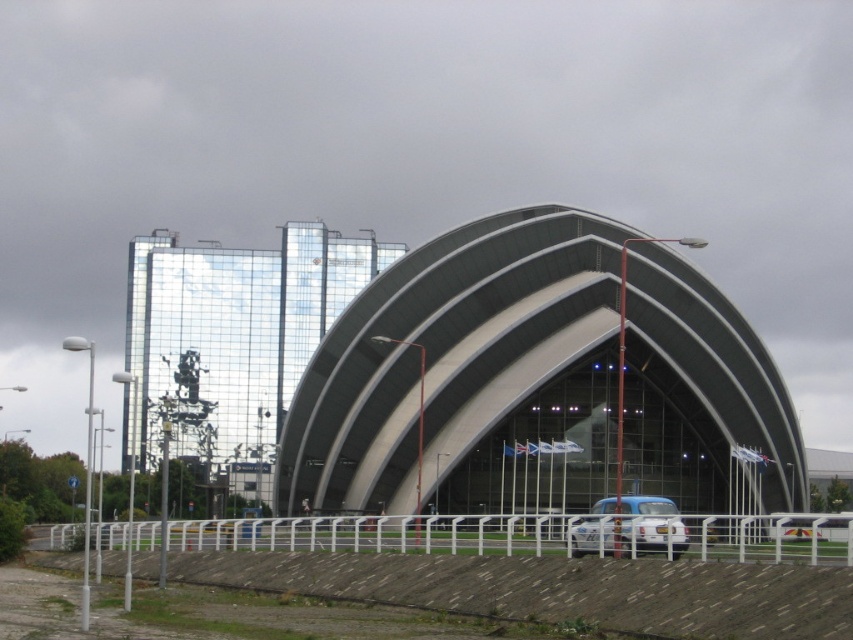
From the picture: You are standing at point (457, 364) in the image. What object is located exactly at your current position?

The smooth glass dome at center is located exactly at point (457, 364).

You are a visitor approaching the smooth glass dome at center and the blue matte car at center. Which object will you see first as you walk towards them?

The smooth glass dome at center is located above the blue matte car at center, so you will see the smooth glass dome at center first as you approach them.